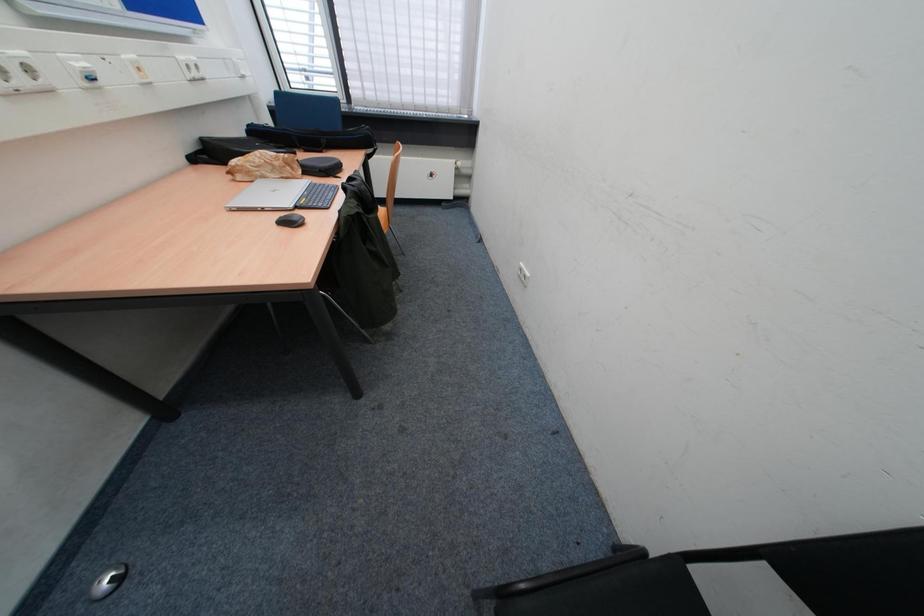
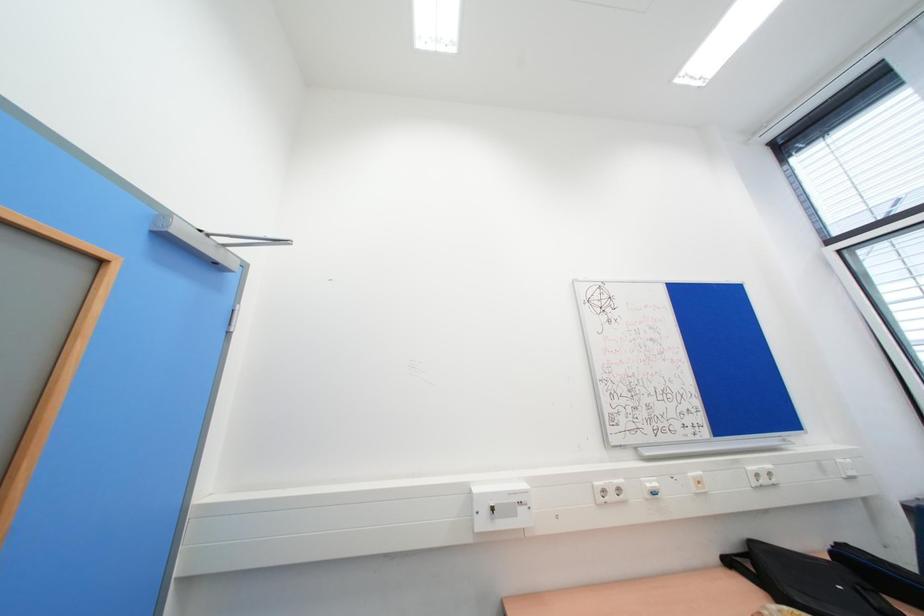
Question: How did the camera likely rotate?

Choices:
 (A) Left
 (B) Right
 (C) Up
 (D) Down

Answer: (A)